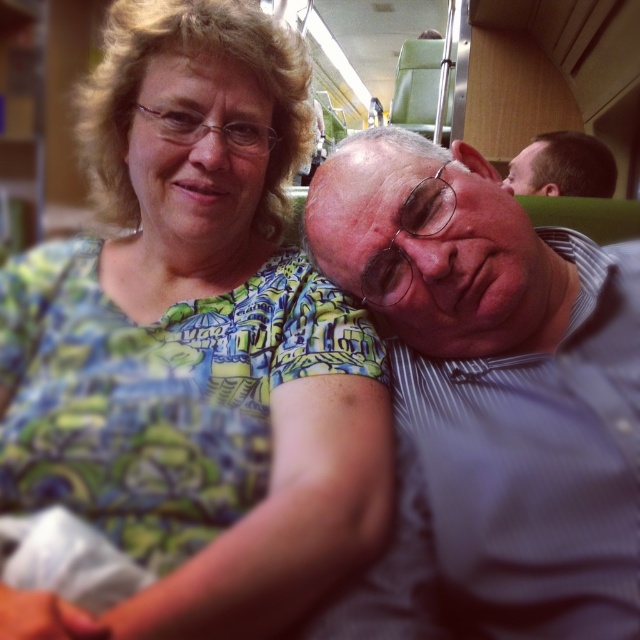
You are a photographer trying to capture a closeup of the green printed fabric at upper left and the matte gray shirt at center. Which object should you focus on first to ensure it appears sharp in the photo?

The green printed fabric at upper left is closer to the viewer than the matte gray shirt at center, so you should focus on the green printed fabric at upper left first to ensure it appears sharp.

You are a passenger on a train and want to reach the green printed fabric at upper left to wipe your glasses. Your hand can extend 18 inches. Can you reach it?

The green printed fabric at upper left is 17.26 inches away from viewer, so yes, your hand can extend 18 inches to reach it.